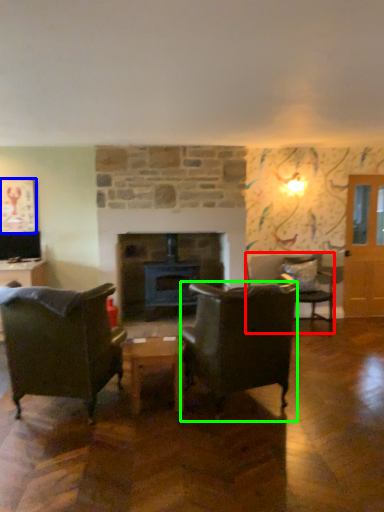
Question: Considering the real-world distances, which object is closest to chair (highlighted by a red box)? picture frame (highlighted by a blue box) or chair (highlighted by a green box).

Choices:
 (A) picture frame
 (B) chair

Answer: (B)